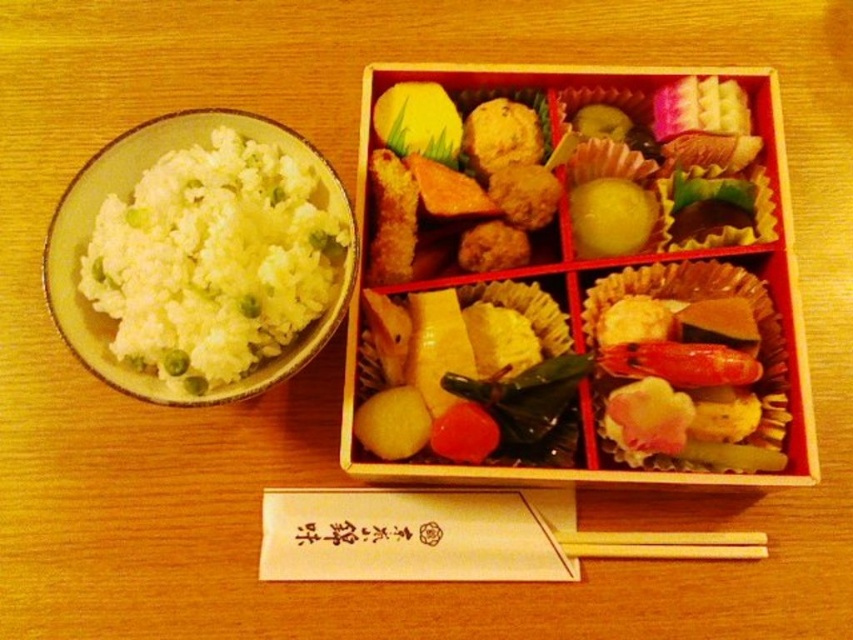
You are standing at the edge of the table where the white matte rice at left is placed. You want to reach for the red bento box to the right. Considering the distance between you and the rice, can you estimate how far you need to stretch your arm to reach the red bento box?

The distance between you and the white matte rice at left is 35.25 inches. Since the red bento box is to the right of the rice, you would need to stretch your arm approximately 35.25 inches to reach it.

You are a guest at a Japanese meal and notice two balls at the center of the table. The shiny golden rice ball at center and the yellow matte ball at center. Which one is taller?

The shiny golden rice ball at center is taller than the yellow matte ball at center.